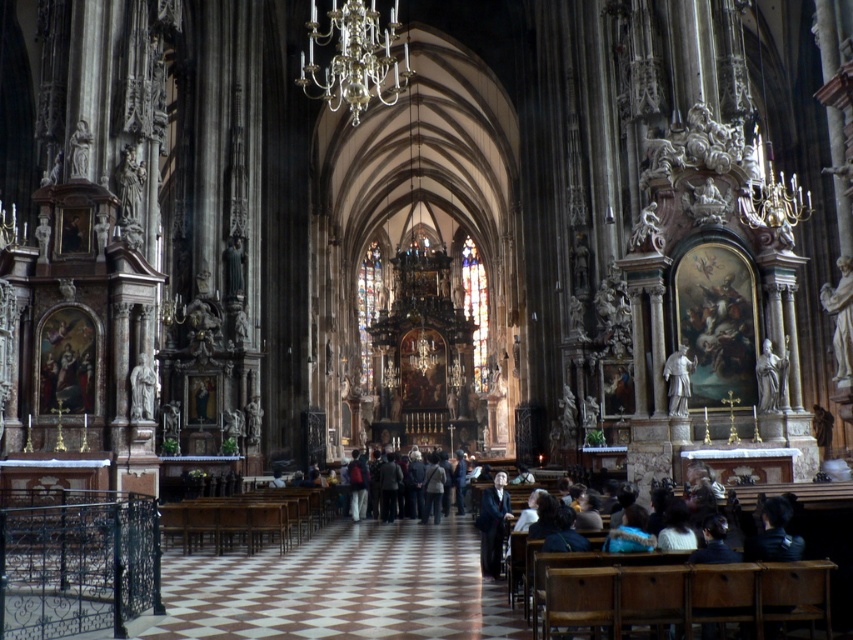
Question: Can you confirm if dark suit at center is smaller than silver statue at right?

Choices:
 (A) no
 (B) yes

Answer: (A)

Question: Is dark suit at center above silver statue at right?

Choices:
 (A) yes
 (B) no

Answer: (B)

Question: Is dark suit at center above gray stone statue at center?

Choices:
 (A) no
 (B) yes

Answer: (A)

Question: Which point is farther from the camera taking this photo?

Choices:
 (A) (781, 397)
 (B) (674, 384)
 (C) (837, 333)

Answer: (B)

Question: Which object is closer to the camera taking this photo?

Choices:
 (A) dark suit at center
 (B) silver statue at right
 (C) gray stone statue at center

Answer: (A)

Question: Which point is closer to the camera taking this photo?

Choices:
 (A) (834, 305)
 (B) (502, 484)
 (C) (772, 401)

Answer: (A)